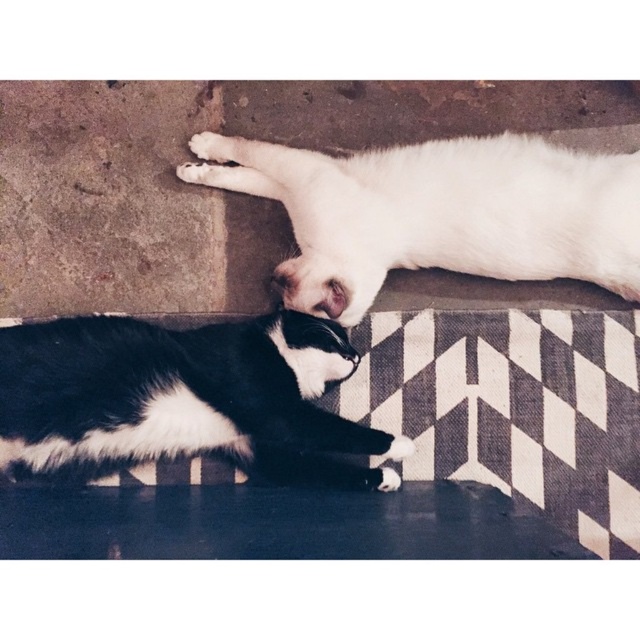
From the picture: How distant is white fluffy cat at upper center from black and white fur cat at lower left?

white fluffy cat at upper center is 9.80 inches away from black and white fur cat at lower left.

Is point (307, 193) behind point (29, 429)?

Yes, it is.

Locate an element on the screen. white fluffy cat at upper center is located at coordinates (440, 214).

Does white fluffy cat at upper center appear on the left side of white fur paw at upper center?

Incorrect, white fluffy cat at upper center is not on the left side of white fur paw at upper center.

Between white fluffy cat at upper center and white fur paw at upper center, which one is positioned lower?

white fluffy cat at upper center is lower down.

Which is behind, point (593, 278) or point (188, 145)?

The point (188, 145) is behind.

Where is `white fluffy cat at upper center`? The image size is (640, 640). white fluffy cat at upper center is located at coordinates (440, 214).

Is black and white fur cat at lower left wider than white fur paw at upper center?

Indeed, black and white fur cat at lower left has a greater width compared to white fur paw at upper center.

Is point (218, 333) behind point (198, 138)?

No, (218, 333) is in front of (198, 138).

What do you see at coordinates (182, 396) in the screenshot?
I see `black and white fur cat at lower left` at bounding box center [182, 396].

The width and height of the screenshot is (640, 640). In order to click on black and white fur cat at lower left in this screenshot , I will do [182, 396].